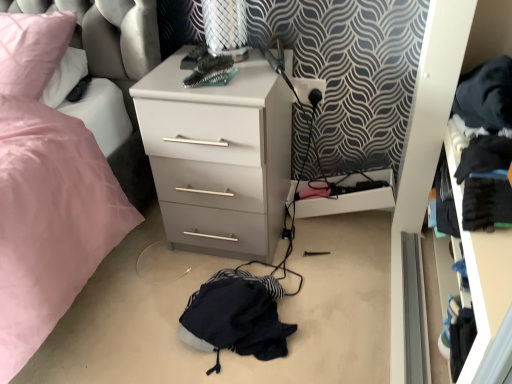
Identify the location of free space to the back side of dark blue fabric at center. The image size is (512, 384). (244, 260).